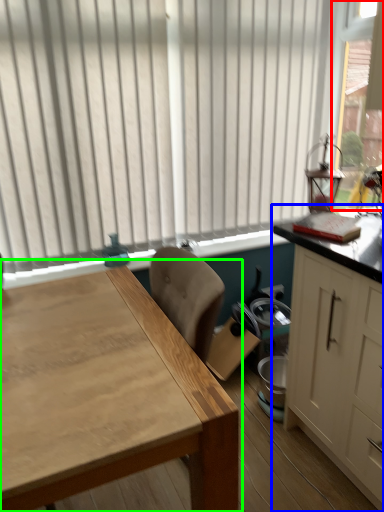
Question: Which object is positioned closest to window screen (highlighted by a red box)? Select from cabinetry (highlighted by a blue box) and table (highlighted by a green box).

Choices:
 (A) cabinetry
 (B) table

Answer: (A)